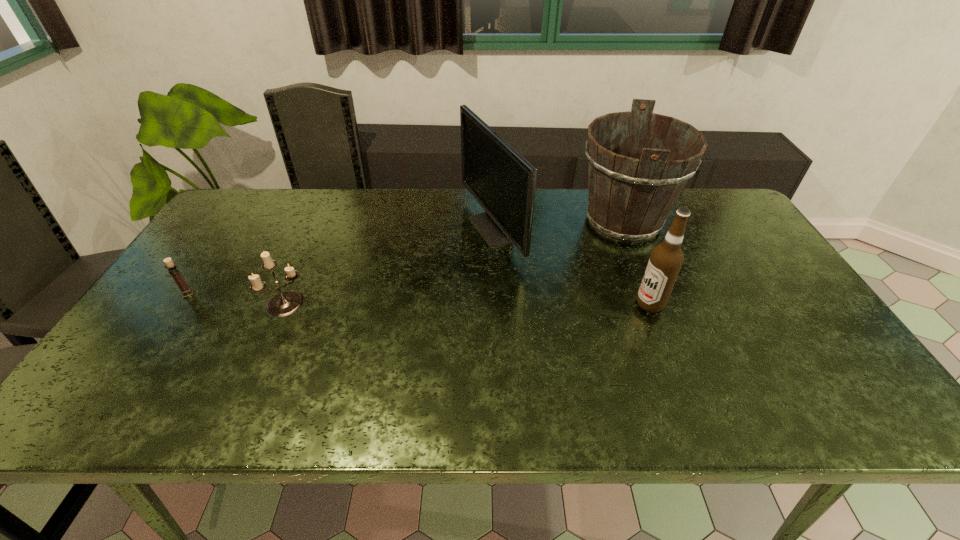
Image resolution: width=960 pixels, height=540 pixels. Identify the location of bucket. (638, 162).

Identify the location of the third object from right to left. The width and height of the screenshot is (960, 540). click(x=503, y=182).

Image resolution: width=960 pixels, height=540 pixels. I want to click on alcohol, so click(x=666, y=259).

Where is `the right candle holder`? the right candle holder is located at coordinates (285, 303).

Identify the location of the shorter candle holder. This screenshot has height=540, width=960. (173, 269).

Locate an element on the screen. the left candle holder is located at coordinates (173, 269).

Identify the location of vacant region located on the front of the bucket. (683, 369).

You are a GUI agent. You are given a task and a screenshot of the screen. Output one action in this format:
    pyautogui.click(x=<x>, y=<y>)
    Task: Click on the vacant area situated on the front-facing side of the computer monitor
    
    Given the screenshot: What is the action you would take?
    pyautogui.click(x=439, y=230)

Locate an element on the screen. The width and height of the screenshot is (960, 540). free spot located 0.260m on the front-facing side of the computer monitor is located at coordinates (377, 230).

Locate an element on the screen. Image resolution: width=960 pixels, height=540 pixels. vacant space located on the front-facing side of the computer monitor is located at coordinates (352, 230).